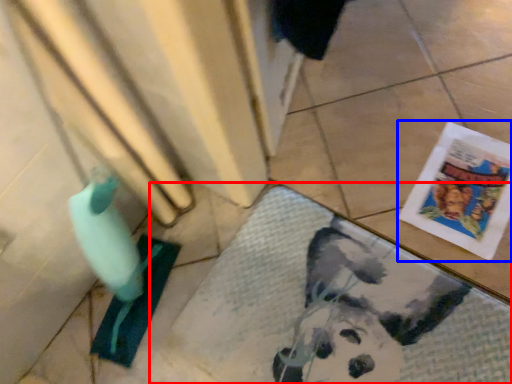
Question: Which point is further to the camera, bath mat (highlighted by a red box) or comic book (highlighted by a blue box)?

Choices:
 (A) bath mat
 (B) comic book

Answer: (B)